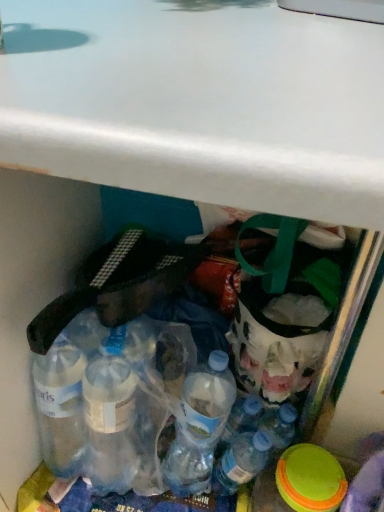
Question: Should I look upward or downward to see translucent plastic bottle at center?

Choices:
 (A) up
 (B) down

Answer: (B)